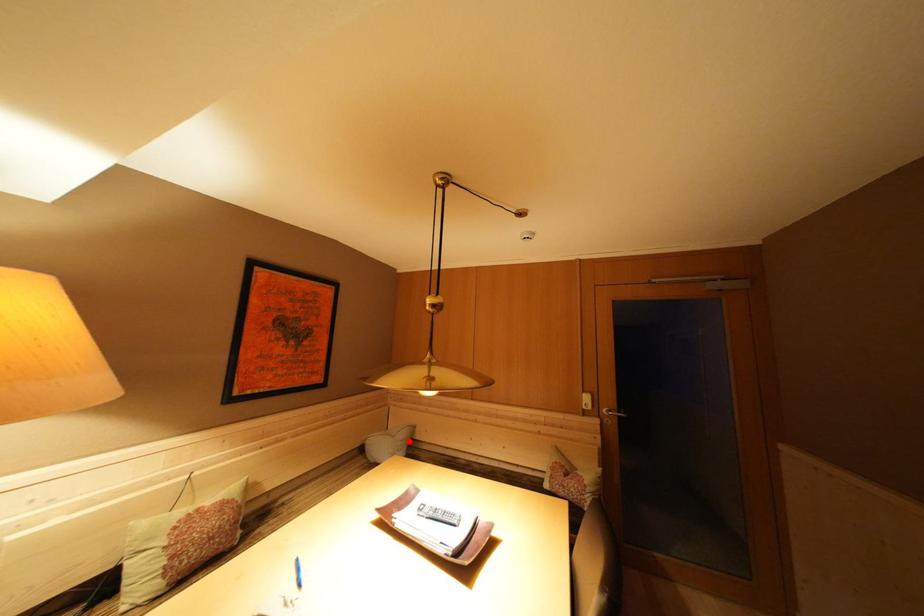
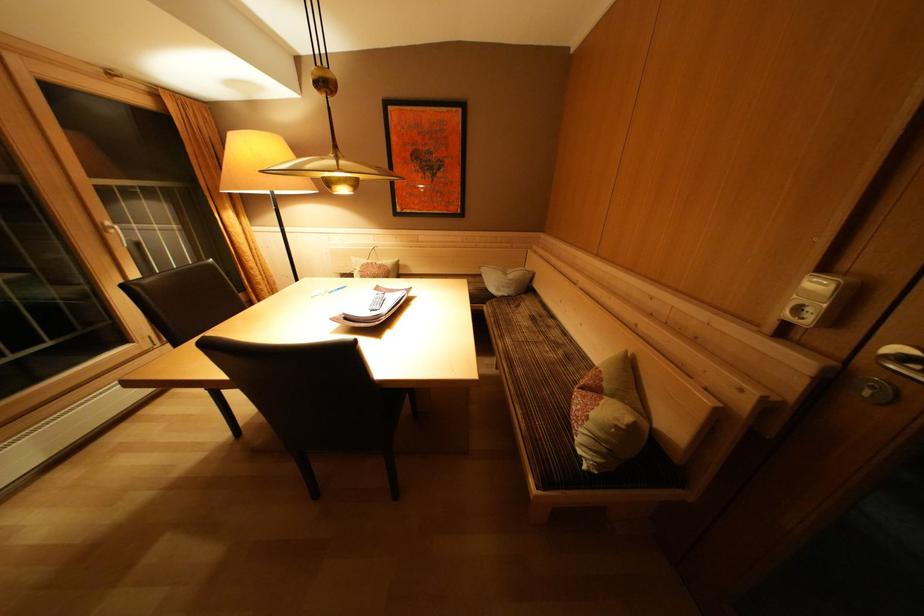
The point at the highlighted location is marked in the first image. Where is the corresponding point in the second image?

(517, 281)